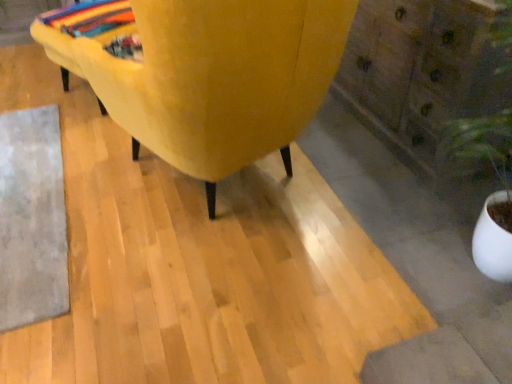
You are a GUI agent. You are given a task and a screenshot of the screen. Output one action in this format:
    pyautogui.click(x=<x>, y=<y>)
    Task: Click on the gray woolen mat at lower left
    The height and width of the screenshot is (384, 512).
    Given the screenshot: What is the action you would take?
    pyautogui.click(x=32, y=218)

The image size is (512, 384). What do you see at coordinates (213, 77) in the screenshot?
I see `velvet yellow chair at center` at bounding box center [213, 77].

You are a GUI agent. You are given a task and a screenshot of the screen. Output one action in this format:
    pyautogui.click(x=<x>, y=<y>)
    Task: Click on the multicolored woven blanket at upper left
    The image size is (512, 384).
    Given the screenshot: What is the action you would take?
    pyautogui.click(x=90, y=17)

Considering the relative positions of gray woolen mat at lower left and velvet yellow chair at center in the image provided, is gray woolen mat at lower left behind velvet yellow chair at center?

Yes, gray woolen mat at lower left is behind velvet yellow chair at center.

Is gray woolen mat at lower left far from velvet yellow chair at center?

gray woolen mat at lower left is near velvet yellow chair at center, not far away.

Does gray woolen mat at lower left turn towards velvet yellow chair at center?

No, gray woolen mat at lower left does not turn towards velvet yellow chair at center.

Can you tell me how much gray woolen mat at lower left and velvet yellow chair at center differ in facing direction?

111 degrees.

Is gray woolen mat at lower left at the back of multicolored woven blanket at upper left?

multicolored woven blanket at upper left does not have its back to gray woolen mat at lower left.

From a real-world perspective, who is located higher, multicolored woven blanket at upper left or gray woolen mat at lower left?

multicolored woven blanket at upper left is physically above.

Is multicolored woven blanket at upper left at the right side of gray woolen mat at lower left?

Yes, multicolored woven blanket at upper left is to the right of gray woolen mat at lower left.

Between multicolored woven blanket at upper left and gray woolen mat at lower left, which one is positioned behind?

multicolored woven blanket at upper left is further from the camera.

Does velvet yellow chair at center touch gray woolen mat at lower left?

No, velvet yellow chair at center is not next to gray woolen mat at lower left.

Is velvet yellow chair at center to the right of gray woolen mat at lower left from the viewer's perspective?

Correct, you'll find velvet yellow chair at center to the right of gray woolen mat at lower left.

Looking at their sizes, would you say velvet yellow chair at center is wider or thinner than gray woolen mat at lower left?

In the image, velvet yellow chair at center appears to be wider than gray woolen mat at lower left.

Does multicolored woven blanket at upper left turn towards velvet yellow chair at center?

No.

Can you tell me how much multicolored woven blanket at upper left and velvet yellow chair at center differ in facing direction?

multicolored woven blanket at upper left and velvet yellow chair at center are facing 94.7 degrees away from each other.

Is multicolored woven blanket at upper left not within velvet yellow chair at center?

Yes, multicolored woven blanket at upper left is located beyond the bounds of velvet yellow chair at center.

From a real-world perspective, is multicolored woven blanket at upper left on top of velvet yellow chair at center?

Actually, multicolored woven blanket at upper left is physically below velvet yellow chair at center in the real world.

What's the angular difference between wooden dresser at lower right and gray woolen mat at lower left's facing directions?

The angular difference between wooden dresser at lower right and gray woolen mat at lower left is 179 degrees.

I want to click on mat in front of the wooden dresser at lower right, so click(32, 218).

Does wooden dresser at lower right have a lesser height compared to gray woolen mat at lower left?

In fact, wooden dresser at lower right may be taller than gray woolen mat at lower left.

Considering the positions of points (389, 32) and (42, 306), is point (389, 32) closer to camera compared to point (42, 306)?

No, (389, 32) is further to viewer.

Considering the positions of objects gray woolen mat at lower left and multicolored woven blanket at upper left in the image provided, who is in front, gray woolen mat at lower left or multicolored woven blanket at upper left?

Positioned in front is gray woolen mat at lower left.

Between gray woolen mat at lower left and multicolored woven blanket at upper left, which one has less height?

Standing shorter between the two is gray woolen mat at lower left.

Between point (33, 200) and point (94, 25), which one is positioned in front?

The point (33, 200) is in front.

Considering the sizes of objects gray woolen mat at lower left and multicolored woven blanket at upper left in the image provided, who is bigger, gray woolen mat at lower left or multicolored woven blanket at upper left?

gray woolen mat at lower left.

Which point is more distant from viewer, (422, 172) or (295, 20)?

Point (422, 172)

From a real-world perspective, does wooden dresser at lower right stand above velvet yellow chair at center?

No, from a real-world perspective, wooden dresser at lower right is not above velvet yellow chair at center.

Who is smaller, wooden dresser at lower right or velvet yellow chair at center?

With smaller size is wooden dresser at lower right.

Considering the relative positions of wooden dresser at lower right and velvet yellow chair at center in the image provided, is wooden dresser at lower right in front of velvet yellow chair at center?

No, it is behind velvet yellow chair at center.

Locate an element on the screen. This screenshot has width=512, height=384. mat on the left of velvet yellow chair at center is located at coordinates (32, 218).

In order to click on blanket on the right side of gray woolen mat at lower left in this screenshot , I will do `click(90, 17)`.

Estimate the real-world distances between objects in this image. Which object is closer to multicolored woven blanket at upper left, velvet yellow chair at center or gray woolen mat at lower left?

Among the two, gray woolen mat at lower left is located nearer to multicolored woven blanket at upper left.

Considering their positions, is velvet yellow chair at center positioned closer to wooden dresser at lower right than multicolored woven blanket at upper left?

Among the two, velvet yellow chair at center is located nearer to wooden dresser at lower right.

Estimate the real-world distances between objects in this image. Which object is closer to gray woolen mat at lower left, multicolored woven blanket at upper left or velvet yellow chair at center?

The object closer to gray woolen mat at lower left is velvet yellow chair at center.

Considering their positions, is multicolored woven blanket at upper left positioned further to wooden dresser at lower right than velvet yellow chair at center?

Based on the image, multicolored woven blanket at upper left appears to be further to wooden dresser at lower right.

Estimate the real-world distances between objects in this image. Which object is further from multicolored woven blanket at upper left, velvet yellow chair at center or wooden dresser at lower right?

Based on the image, wooden dresser at lower right appears to be further to multicolored woven blanket at upper left.

Estimate the real-world distances between objects in this image. Which object is closer to velvet yellow chair at center, gray woolen mat at lower left or wooden dresser at lower right?

Based on the image, gray woolen mat at lower left appears to be nearer to velvet yellow chair at center.

Considering their positions, is velvet yellow chair at center positioned further to gray woolen mat at lower left than multicolored woven blanket at upper left?

Based on the image, multicolored woven blanket at upper left appears to be further to gray woolen mat at lower left.

From the image, which object appears to be farther from multicolored woven blanket at upper left, wooden dresser at lower right or velvet yellow chair at center?

wooden dresser at lower right lies further to multicolored woven blanket at upper left than the other object.

You are a GUI agent. You are given a task and a screenshot of the screen. Output one action in this format:
    pyautogui.click(x=<x>, y=<y>)
    Task: Click on the furniture between multicolored woven blanket at upper left and wooden dresser at lower right in the horizontal direction
    
    Given the screenshot: What is the action you would take?
    213,77

Identify the location of furniture between gray woolen mat at lower left and wooden dresser at lower right in the horizontal direction. The image size is (512, 384). (213, 77).

Locate an element on the screen. blanket between gray woolen mat at lower left and wooden dresser at lower right in the horizontal direction is located at coordinates (90, 17).

At what (x,y) coordinates should I click in order to perform the action: click on mat between velvet yellow chair at center and multicolored woven blanket at upper left in the front-back direction. Please return your answer as a coordinate pair (x, y). This screenshot has height=384, width=512. Looking at the image, I should click on (32, 218).